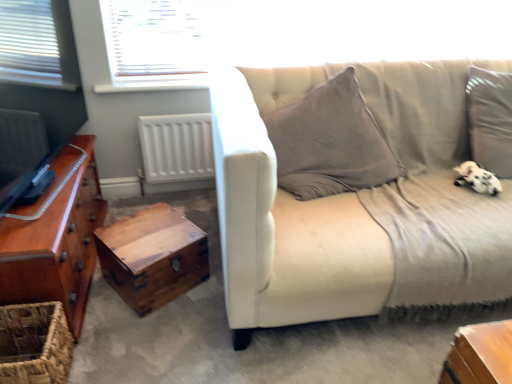
Question: Would you say white fluffy dog at lower right is inside or outside wooden chest at lower left?

Choices:
 (A) inside
 (B) outside

Answer: (B)

Question: Based on their sizes in the image, would you say white fluffy dog at lower right is bigger or smaller than wooden chest at lower left?

Choices:
 (A) small
 (B) big

Answer: (A)

Question: Which of these objects is positioned closest to the white fluffy dog at lower right?

Choices:
 (A) woven brown basket at lower left
 (B) wooden chest at lower left
 (C) shiny brown wooden chest of drawers at left
 (D) gray corduroy couch at right

Answer: (D)

Question: Which is farther from the white fluffy dog at lower right?

Choices:
 (A) woven brown basket at lower left
 (B) shiny brown wooden chest of drawers at left
 (C) wooden chest at lower left
 (D) gray corduroy couch at right

Answer: (A)